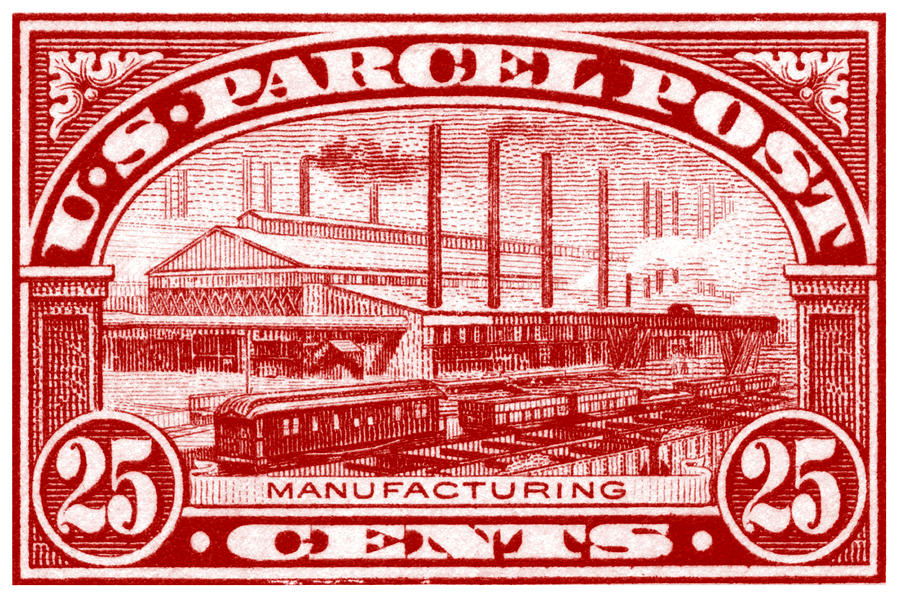
You are a GUI agent. You are given a task and a screenshot of the screen. Output one action in this format:
    pyautogui.click(x=<x>, y=<y>)
    Task: Click on the white outline of arch
    Image resolution: width=900 pixels, height=597 pixels.
    Given the screenshot: What is the action you would take?
    pyautogui.click(x=75, y=270), pyautogui.click(x=443, y=24), pyautogui.click(x=831, y=270)